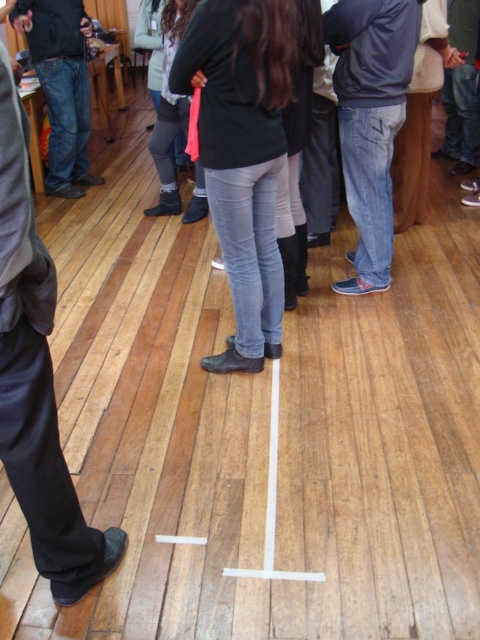
You are a photographer setting up a shoot in this indoor scene. You need to place a small prop between the black leather pants at left and the denim jeans at left. Based on their positions, where should you place the prop so it is between them?

The prop should be placed below the denim jeans at left since the black leather pants at left is located below denim jeans at left.

You are a photographer setting up a shoot. You need to position a prop on the floor between the black leather pants at left and the jeans at center. According to the scene description, where should you place the prop so it is between them?

The prop should be placed between the black leather pants at left and the jeans at center, positioned above the black leather pants at left since it is located below the jeans at center.